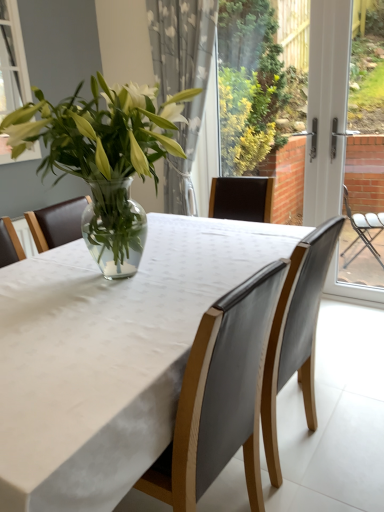
Question: Is point click(244, 388) closer or farther from the camera than point click(319, 215)?

Choices:
 (A) farther
 (B) closer

Answer: (B)

Question: From the image's perspective, is matte gray chair at center, the 1th chair when ordered from left to right, positioned above or below white plastic screen door at right?

Choices:
 (A) above
 (B) below

Answer: (B)

Question: Estimate the real-world distances between objects in this image. Which object is closer to the white sheer curtain at upper center?

Choices:
 (A) matte gray chair at center, the second chair from the right
 (B) white fabric table at center
 (C) white plastic screen door at right
 (D) leather chair at center, the 1th chair in the right-to-left sequence

Answer: (C)

Question: Which object is positioned closest to the leather chair at center, the 1th chair in the right-to-left sequence?

Choices:
 (A) white fabric table at center
 (B) white sheer curtain at upper center
 (C) white plastic screen door at right
 (D) matte gray chair at center, the 1th chair when ordered from left to right

Answer: (D)